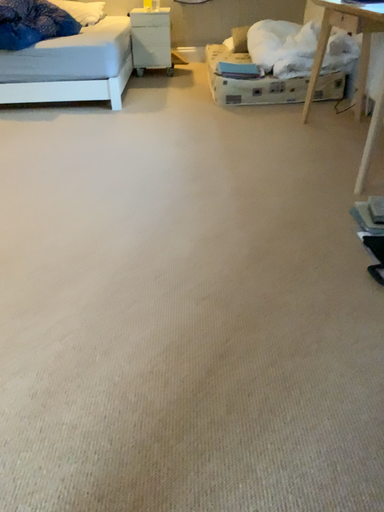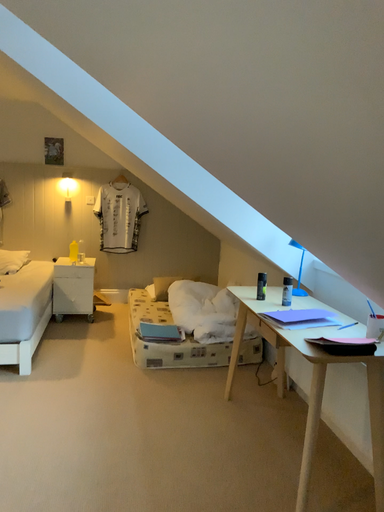
Question: Which way did the camera rotate in the video?

Choices:
 (A) rotated upward
 (B) rotated downward

Answer: (A)